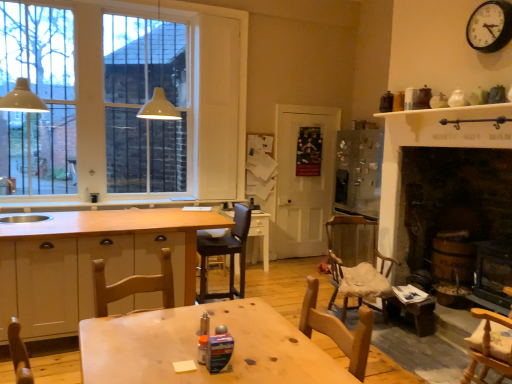
Find the location of `free space above white matte door at center (from a real-world perspective)`. free space above white matte door at center (from a real-world perspective) is located at coordinates (309, 105).